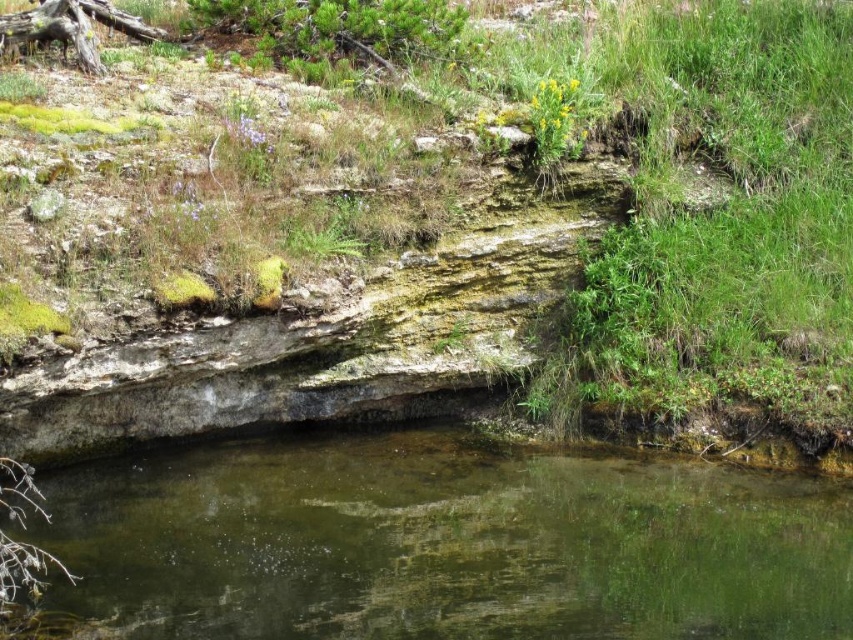
Question: Is green mossy rock at center above clear water at bottom?

Choices:
 (A) yes
 (B) no

Answer: (A)

Question: Which point is farther from the camera taking this photo?

Choices:
 (A) (248, 520)
 (B) (636, 115)

Answer: (B)

Question: Which of the following is the farthest from the observer?

Choices:
 (A) (338, 589)
 (B) (456, 260)

Answer: (B)

Question: Is green mossy rock at center positioned in front of clear water at bottom?

Choices:
 (A) yes
 (B) no

Answer: (B)

Question: Which object is farther from the camera taking this photo?

Choices:
 (A) clear water at bottom
 (B) green mossy rock at center

Answer: (B)

Question: Can you confirm if green mossy rock at center is thinner than clear water at bottom?

Choices:
 (A) yes
 (B) no

Answer: (A)